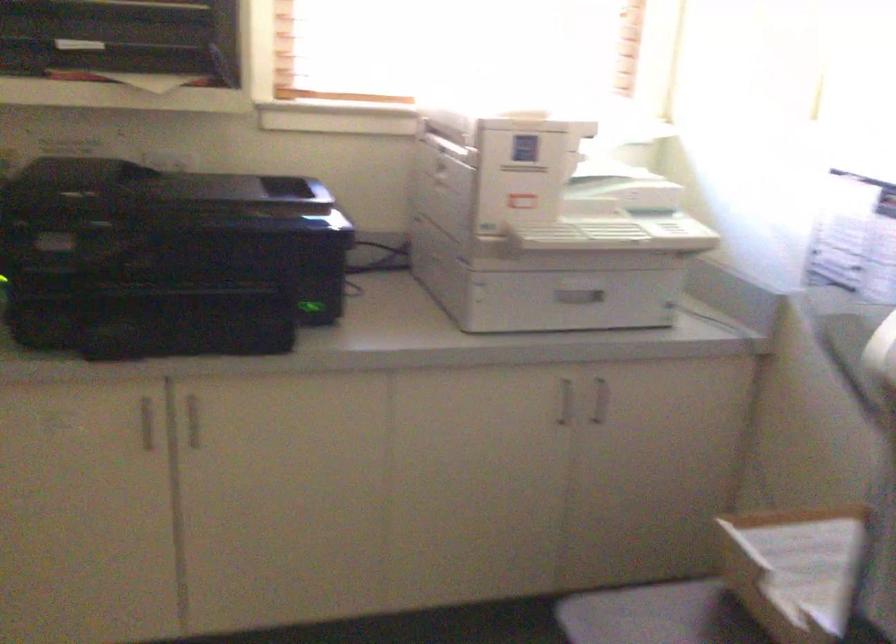
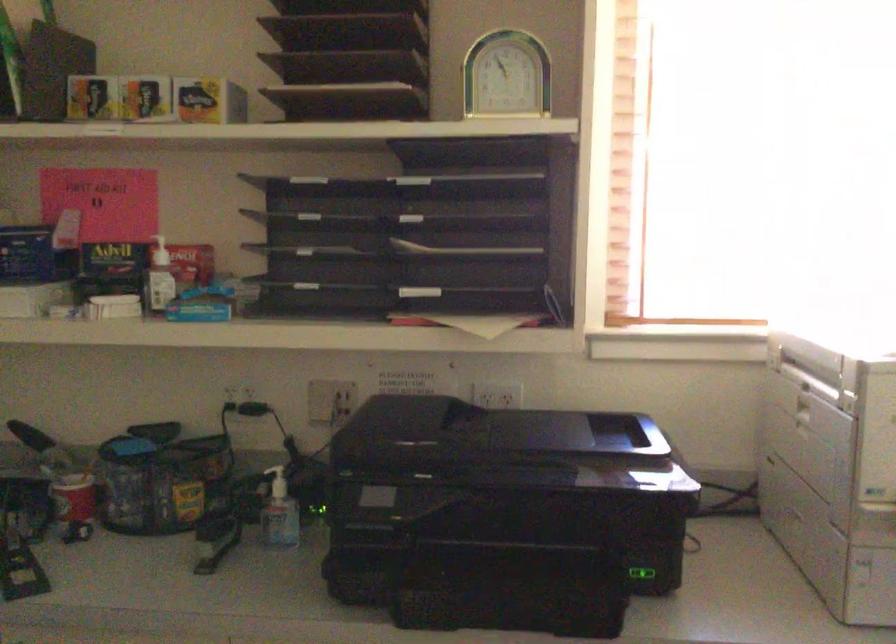
Question: The first image is from the beginning of the video and the second image is from the end. How did the camera likely rotate when shooting the video?

Choices:
 (A) Left
 (B) Right
 (C) Up
 (D) Down

Answer: (A)